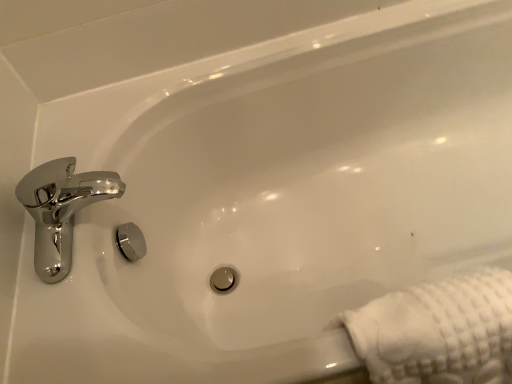
Question: Does chrome/metallic faucet at upper left turn towards white textured towel at lower right?

Choices:
 (A) yes
 (B) no

Answer: (B)

Question: Considering the relative sizes of chrome/metallic faucet at upper left and white textured towel at lower right in the image provided, is chrome/metallic faucet at upper left smaller than white textured towel at lower right?

Choices:
 (A) yes
 (B) no

Answer: (A)

Question: Is chrome/metallic faucet at upper left surrounding white textured towel at lower right?

Choices:
 (A) no
 (B) yes

Answer: (A)

Question: Is chrome/metallic faucet at upper left bigger than white textured towel at lower right?

Choices:
 (A) yes
 (B) no

Answer: (B)

Question: Does chrome/metallic faucet at upper left come behind white textured towel at lower right?

Choices:
 (A) yes
 (B) no

Answer: (A)

Question: Is chrome/metallic faucet at upper left in contact with white textured towel at lower right?

Choices:
 (A) no
 (B) yes

Answer: (A)

Question: Is white textured towel at lower right behind chrome/metallic faucet at upper left?

Choices:
 (A) yes
 (B) no

Answer: (B)

Question: Can we say white textured towel at lower right lies outside chrome/metallic faucet at upper left?

Choices:
 (A) no
 (B) yes

Answer: (B)

Question: Does white textured towel at lower right appear on the right side of chrome/metallic faucet at upper left?

Choices:
 (A) no
 (B) yes

Answer: (B)

Question: From the image's perspective, is white textured towel at lower right on top of chrome/metallic faucet at upper left?

Choices:
 (A) no
 (B) yes

Answer: (A)

Question: Is white textured towel at lower right positioned far away from chrome/metallic faucet at upper left?

Choices:
 (A) no
 (B) yes

Answer: (A)

Question: From a real-world perspective, is white textured towel at lower right on top of chrome/metallic faucet at upper left?

Choices:
 (A) no
 (B) yes

Answer: (A)

Question: Relative to white textured towel at lower right, is chrome/metallic faucet at upper left in front or behind?

Choices:
 (A) behind
 (B) front

Answer: (A)